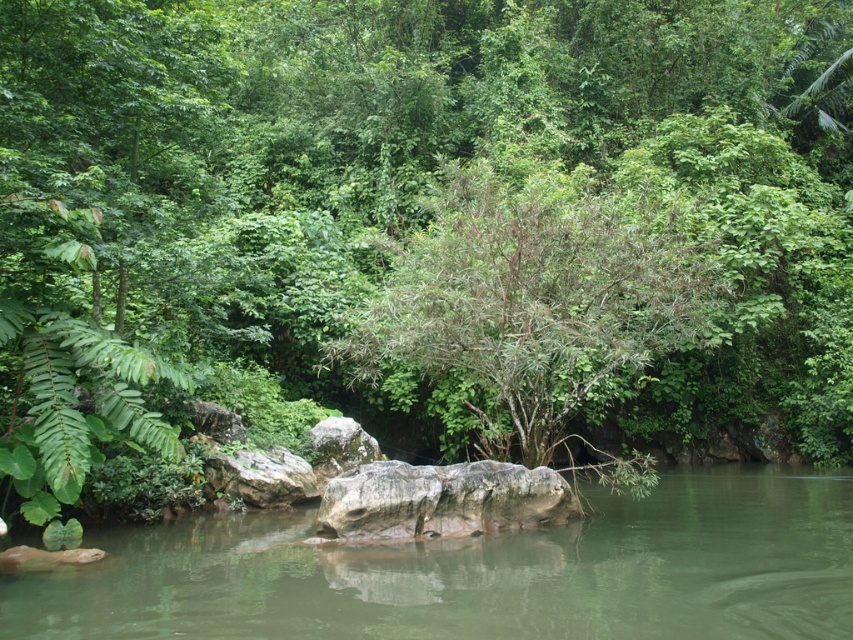
Question: Observing the image, what is the correct spatial positioning of brown/dry wood tree at center in reference to gray rough boulder at center?

Choices:
 (A) right
 (B) left

Answer: (A)

Question: Does green smooth water at center have a smaller size compared to brown/dry wood tree at center?

Choices:
 (A) yes
 (B) no

Answer: (A)

Question: From the image, what is the correct spatial relationship of green smooth water at center in relation to brown/dry wood tree at center?

Choices:
 (A) left
 (B) right

Answer: (B)

Question: Which object appears farthest from the camera in this image?

Choices:
 (A) gray rough boulder at center
 (B) green smooth water at center

Answer: (A)

Question: Which point appears closest to the camera in this image?

Choices:
 (A) (480, 476)
 (B) (244, 570)

Answer: (B)

Question: Which object is positioned farthest from the brown/dry wood tree at center?

Choices:
 (A) green smooth water at center
 (B) gray rough boulder at center

Answer: (A)